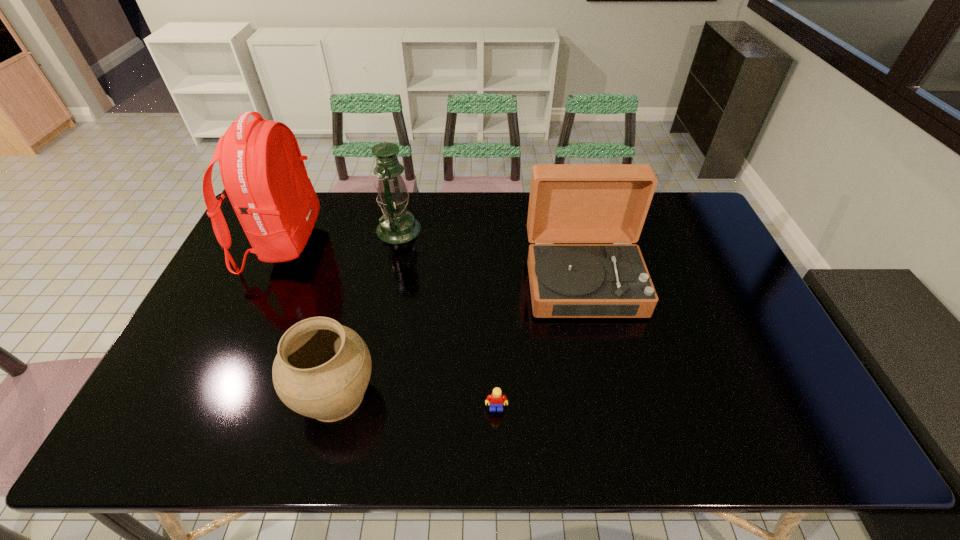
Identify the location of vacant space that is in between the oil lamp and the second shortest object. The image size is (960, 540). (367, 312).

This screenshot has height=540, width=960. Find the location of `vacant area between the oil lamp and the backpack`. vacant area between the oil lamp and the backpack is located at coordinates (341, 237).

Point out which object is positioned as the fourth nearest to the tallest object. Please provide its 2D coordinates. Your answer should be formatted as a tuple, i.e. [(x, y)], where the tuple contains the x and y coordinates of a point satisfying the conditions above.

[(569, 203)]

The width and height of the screenshot is (960, 540). What are the coordinates of `the second closest object to the oil lamp` in the screenshot? It's located at (569, 203).

You are a GUI agent. You are given a task and a screenshot of the screen. Output one action in this format:
    pyautogui.click(x=<x>, y=<y>)
    Task: Click on the vacant region that satisfies the following two spatial constraints: 1. on the main compartment of the second shortest object; 2. on the right side of the leftmost object
    This screenshot has width=960, height=540.
    Given the screenshot: What is the action you would take?
    pyautogui.click(x=213, y=395)